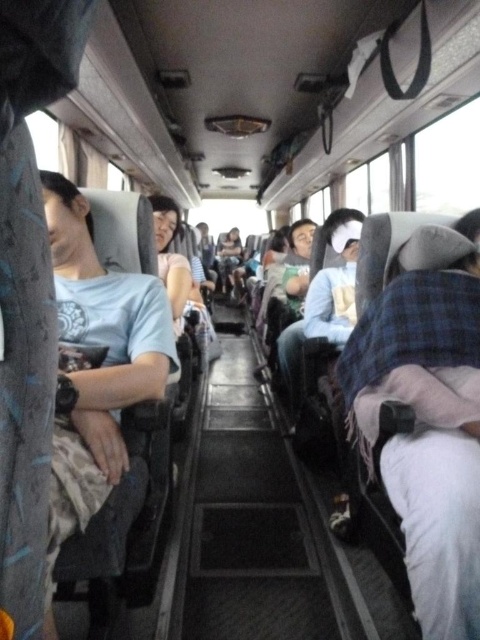
Identify the location of matte gray shirt at left. The height and width of the screenshot is (640, 480). (104, 358).

How much distance is there between matte gray shirt at left and light blue fabric pillow at center?

matte gray shirt at left and light blue fabric pillow at center are 5.06 feet apart.

Does point (107, 355) come farther from viewer compared to point (358, 243)?

No, it is not.

The image size is (480, 640). I want to click on matte gray shirt at left, so [x=104, y=358].